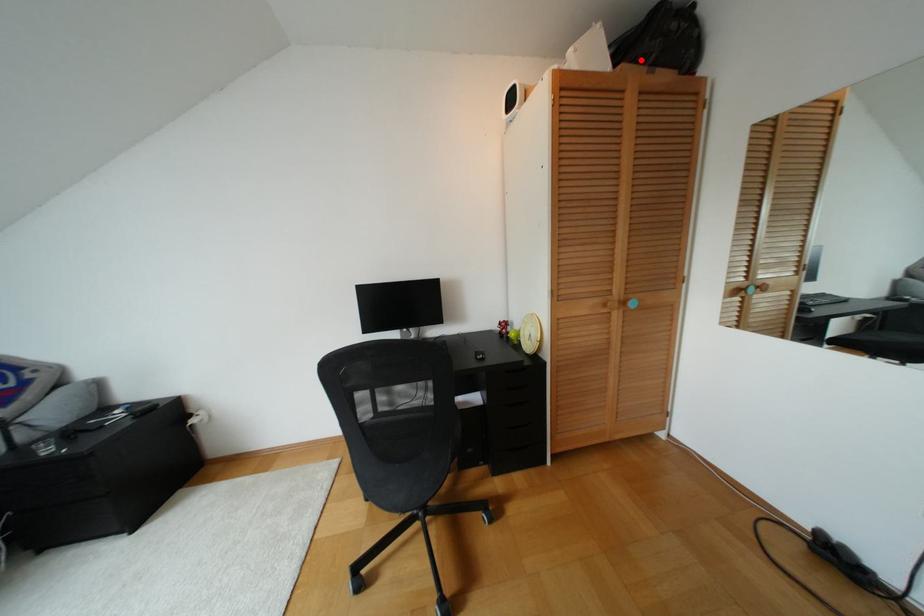
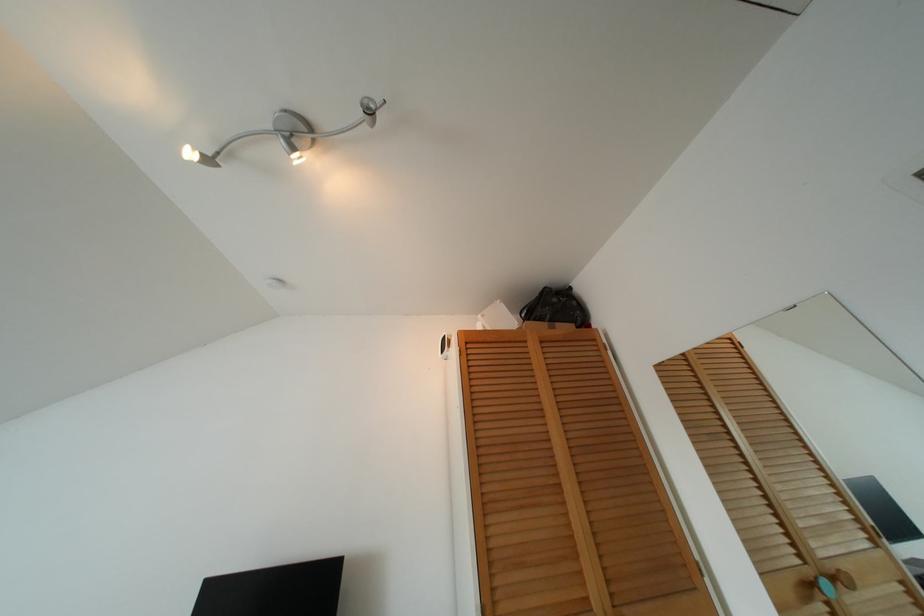
Where in the second image is the point corresponding to the highlighted location from the first image?

(541, 318)